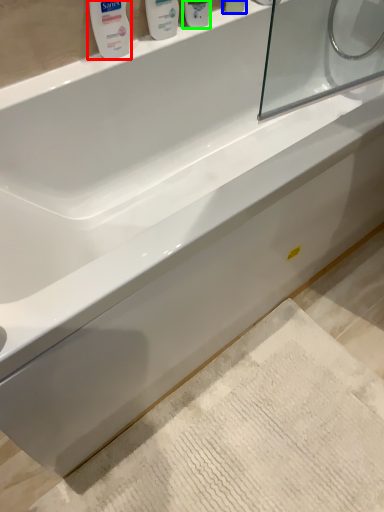
Question: Based on their relative distances, which object is farther from mouthwash (highlighted by a red box)? Choose from mouthwash (highlighted by a blue box) and mouthwash (highlighted by a green box).

Choices:
 (A) mouthwash
 (B) mouthwash

Answer: (A)